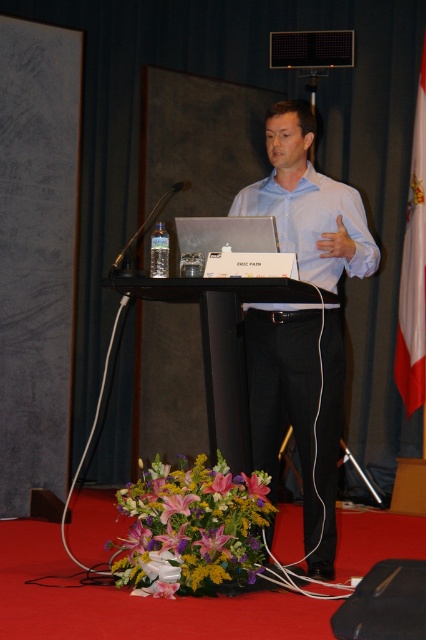
Question: Is white glossy shirt at center thinner than white fabric flag at right?

Choices:
 (A) yes
 (B) no

Answer: (B)

Question: Is white smooth shirt at center below white fabric flag at right?

Choices:
 (A) no
 (B) yes

Answer: (B)

Question: Which point is farther to the camera?

Choices:
 (A) white fabric flag at right
 (B) glossy floral arrangement at lower center

Answer: (A)

Question: Does white smooth shirt at center have a smaller size compared to white fabric flag at right?

Choices:
 (A) no
 (B) yes

Answer: (A)

Question: Which object appears farthest from the camera in this image?

Choices:
 (A) white smooth shirt at center
 (B) white glossy shirt at center

Answer: (A)

Question: Which object is the farthest from the white glossy shirt at center?

Choices:
 (A) glossy floral arrangement at lower center
 (B) white fabric flag at right

Answer: (B)